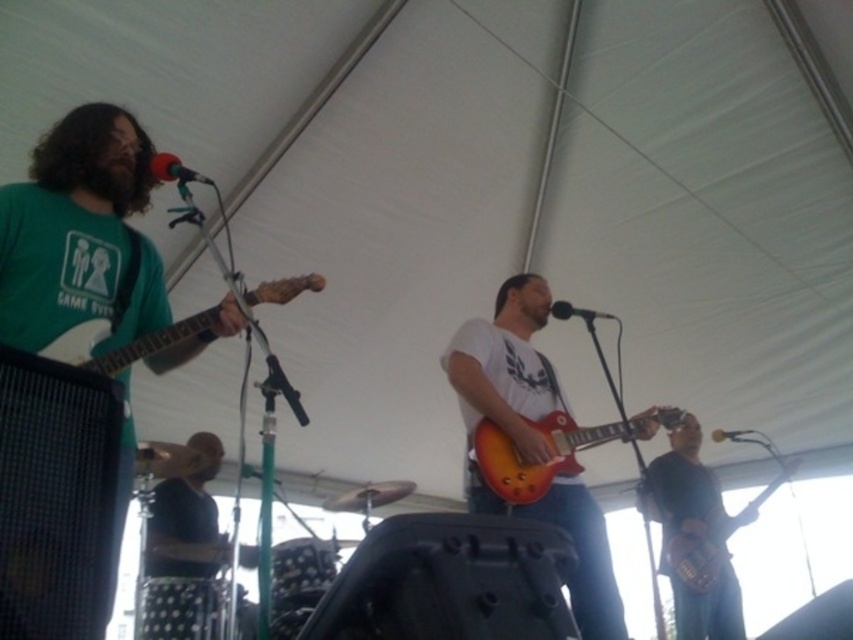
Question: Is black matte microphone at center bigger than metallic silver microphone at upper center?

Choices:
 (A) yes
 (B) no

Answer: (A)

Question: Considering the real-world distances, which object is closest to the matte orange guitar at center?

Choices:
 (A) shiny metallic guitar at lower right
 (B) black matte microphone at center

Answer: (B)

Question: Which object is farther from the camera taking this photo?

Choices:
 (A) metallic silver microphone at upper center
 (B) black matte microphone at upper left

Answer: (A)

Question: Does matte orange guitar at center appear under shiny metallic guitar at lower right?

Choices:
 (A) yes
 (B) no

Answer: (B)

Question: Among these points, which one is farthest from the camera?

Choices:
 (A) (691, 586)
 (B) (540, 419)
 (C) (194, 176)

Answer: (A)

Question: Does matte orange guitar at center have a lesser width compared to metallic silver microphone at upper center?

Choices:
 (A) yes
 (B) no

Answer: (B)